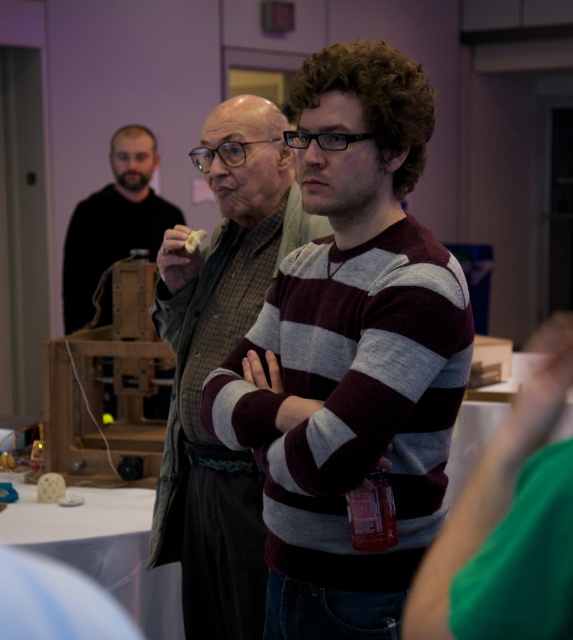
Where is the striped sweater at center located in the image?

The striped sweater at center is located at point [218,364].

You are attending a workshop and notice two items at the center of the scene. The striped sweater at center and the yellow crumbly food at center. Which item is taller?

The striped sweater at center is much taller than the yellow crumbly food at center.